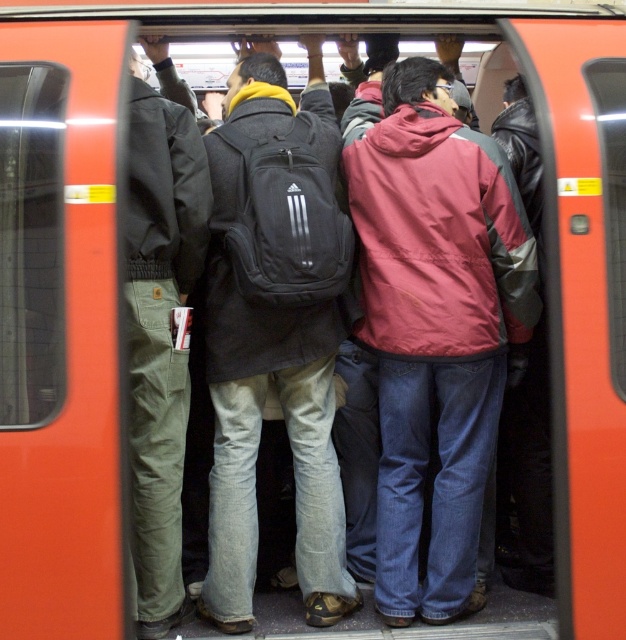
You are a passenger on the subway train and want to exit through the door. You see the black fabric backpack at center and the olive green corduroy pants at left. Which one is blocking your path to the door?

The olive green corduroy pants at left is behind the black fabric backpack at center, so the black fabric backpack at center is blocking your path to the door.

You are a passenger on the subway and want to locate the red nylon jacket at center and the olive green corduroy pants at left. From the perspective of someone facing the door, which item is positioned to the right?

The red nylon jacket at center is to the right of the olive green corduroy pants at left, so from the perspective of someone facing the door, the red nylon jacket at center is positioned to the right.